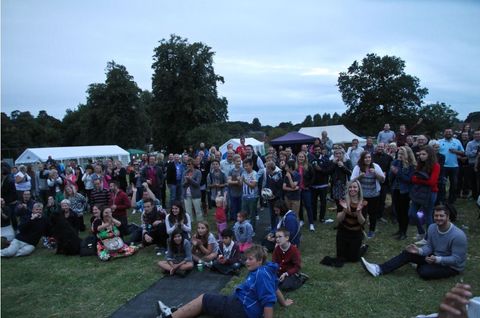
Where is `wooden blocks`? Image resolution: width=480 pixels, height=318 pixels. wooden blocks is located at coordinates (450, 305), (454, 300), (464, 290), (464, 283).